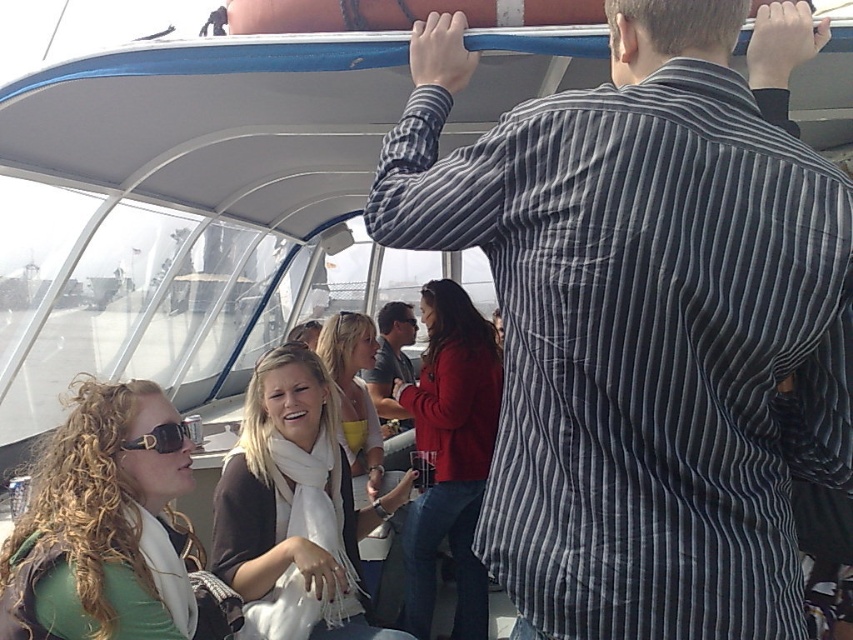
Does matte red jacket at center have a lesser width compared to black plastic sunglasses at lower left?

In fact, matte red jacket at center might be wider than black plastic sunglasses at lower left.

Is point (494, 435) positioned behind point (138, 445)?

That is True.

The image size is (853, 640). I want to click on matte red jacket at center, so click(450, 456).

Who is higher up, striped shirt at upper right or white scarf at center?

Positioned higher is striped shirt at upper right.

From the picture: Between striped shirt at upper right and white scarf at center, which one appears on the right side from the viewer's perspective?

striped shirt at upper right is more to the right.

Does point (532, 598) come behind point (323, 596)?

No, (532, 598) is in front of (323, 596).

Locate an element on the screen. striped shirt at upper right is located at coordinates (642, 326).

Which of these two, white scarf at center or matte red jacket at center, stands shorter?

white scarf at center

Is white scarf at center thinner than matte red jacket at center?

No.

Does point (308, 422) come behind point (451, 480)?

No.

Identify the location of white scarf at center. Image resolution: width=853 pixels, height=640 pixels. (294, 497).